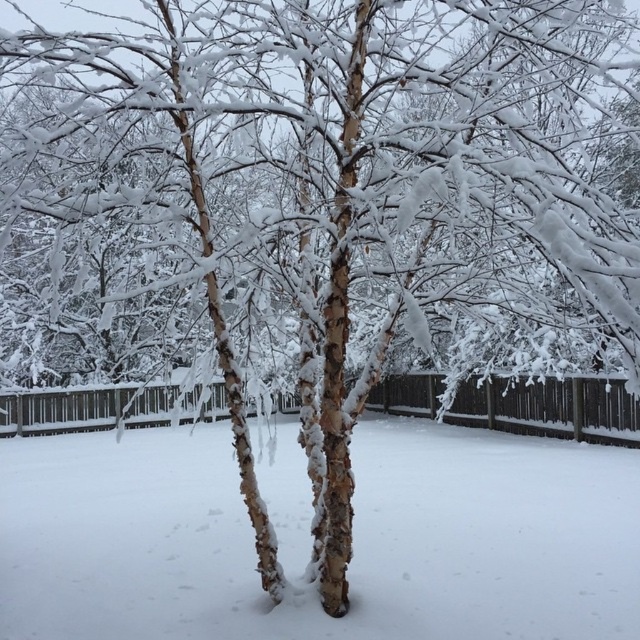
Question: Is white textured snow at center thinner than brown wooden fence at center?

Choices:
 (A) yes
 (B) no

Answer: (A)

Question: Can you confirm if white textured snow at center is thinner than brown wooden fence at center?

Choices:
 (A) yes
 (B) no

Answer: (A)

Question: Is white textured snow at center positioned in front of brown wooden fence at center?

Choices:
 (A) yes
 (B) no

Answer: (A)

Question: Which object appears closest to the camera in this image?

Choices:
 (A) white textured snow at center
 (B) brown wooden fence at center

Answer: (A)

Question: Which point is farther to the camera?

Choices:
 (A) (625, 438)
 (B) (573, 513)

Answer: (A)